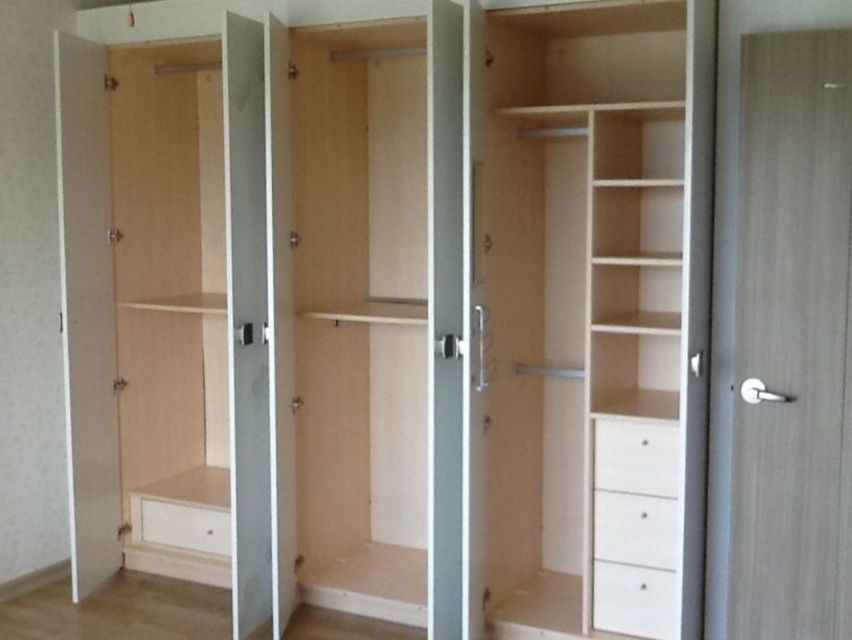
You are organizing your wardrobe and want to place a pair of shoes in one of the drawers. The shoes are 20 cm wide. Which drawer, the white matte drawer at lower center or the white matte drawer at lower left, can accommodate the shoes?

The white matte drawer at lower left has a greater width than the white matte drawer at lower center, so it can accommodate the 20 cm wide shoes.

You are organizing the wardrobe and need to place a box that requires 20 cm of space between the white matte drawer at lower right and the white wood drawer at lower right. Is there enough space?

The white matte drawer at lower right is to the left of the white wood drawer at lower right, but the exact distance between them is not specified. Therefore, it is uncertain if there is enough space for the box requiring 20 cm.